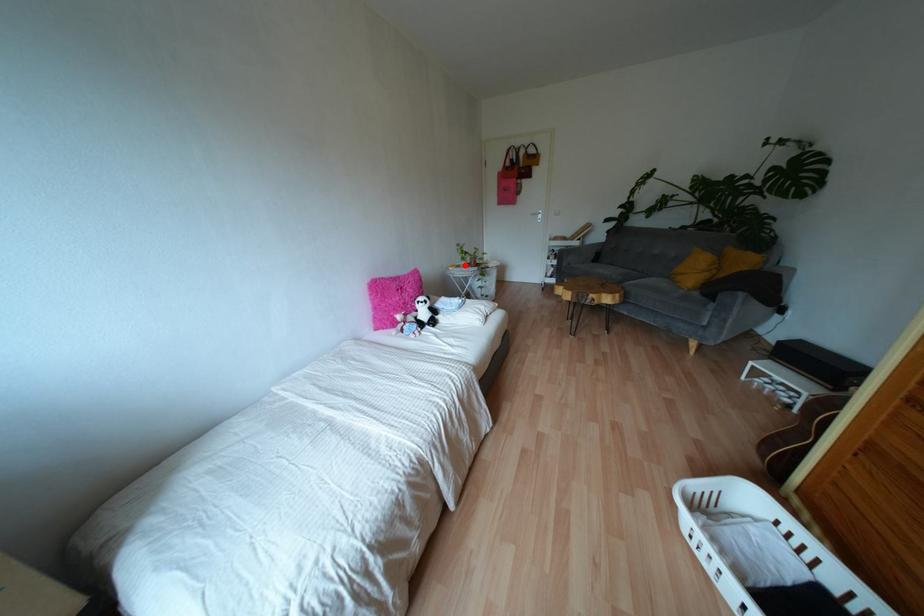
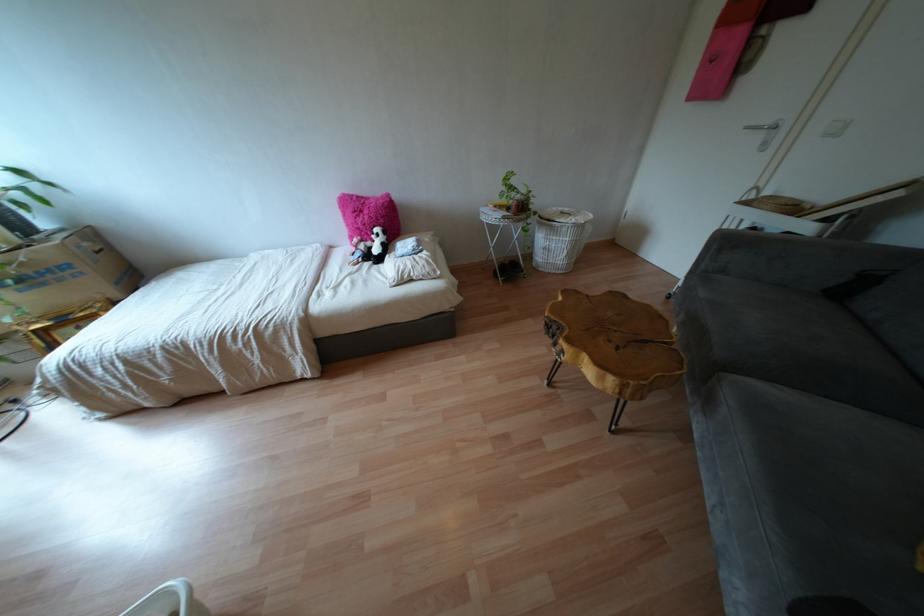
Locate, in the second image, the point that corresponds to the highlighted location in the first image.

(506, 208)